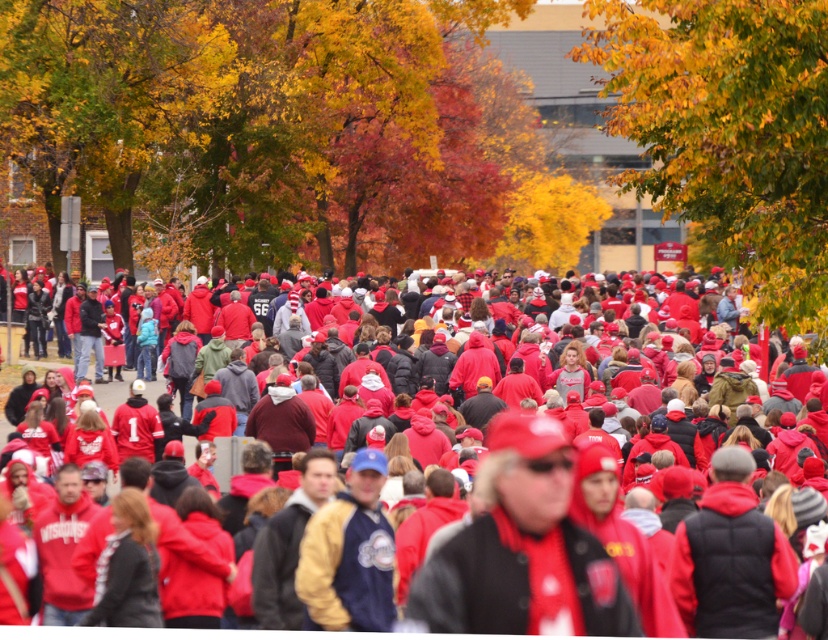
Is point (605, 632) positioned after point (113, 400)?

No.

Is point (580, 564) in front of point (229, 474)?

That is True.

Find the location of `matte red cap at center`. matte red cap at center is located at coordinates (523, 552).